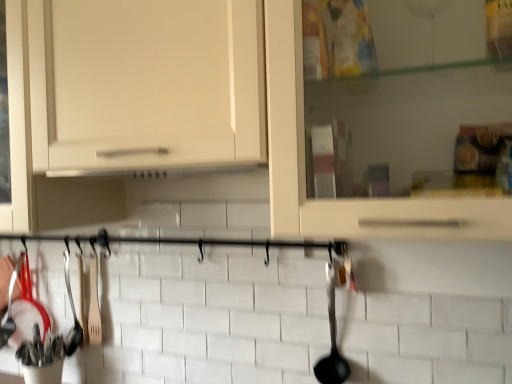
In order to face black plastic ladle at right, acting as the 2th silverware starting from the left, should I rotate leftwards or rightwards?

Turn right by 10.298 degrees to look at black plastic ladle at right, acting as the 2th silverware starting from the left.

Where is `wooden spatula at left, which is the 1th silverware in left-to-right order`? wooden spatula at left, which is the 1th silverware in left-to-right order is located at coordinates tap(72, 313).

Are white matte cabinet at center and black plastic ladle at right, the 1th silverware when ordered from right to left, beside each other?

white matte cabinet at center and black plastic ladle at right, the 1th silverware when ordered from right to left, are not in contact.

Which object is further away from the camera, white matte cabinet at center or black plastic ladle at right, which is the second silverware from back to front?

black plastic ladle at right, which is the second silverware from back to front, is further from the camera.

Does white matte cabinet at center have a smaller size compared to black plastic ladle at right, the 1th silverware when ordered from right to left?

No, white matte cabinet at center is not smaller than black plastic ladle at right, the 1th silverware when ordered from right to left.

From the image's perspective, does white matte cabinet at center appear lower than black plastic ladle at right, acting as the 2th silverware starting from the left?

No, from the image's perspective, white matte cabinet at center is not below black plastic ladle at right, acting as the 2th silverware starting from the left.

Is wooden spatula at left, acting as the second silverware starting from the right, bigger or smaller than white matte cabinet at center?

wooden spatula at left, acting as the second silverware starting from the right, is smaller than white matte cabinet at center.

Does wooden spatula at left, the 1th silverware viewed from the back, turn towards white matte cabinet at center?

No, wooden spatula at left, the 1th silverware viewed from the back, is not oriented towards white matte cabinet at center.

Based on the photo, considering the relative sizes of wooden spatula at left, acting as the second silverware starting from the right, and white matte cabinet at center in the image provided, is wooden spatula at left, acting as the second silverware starting from the right, thinner than white matte cabinet at center?

Yes.

From a real-world perspective, between wooden spatula at left, acting as the second silverware starting from the right, and black plastic ladle at right, placed as the first silverware when sorted from front to back, who is vertically lower?

From a 3D spatial view, black plastic ladle at right, placed as the first silverware when sorted from front to back, is below.

How different are the orientations of wooden spatula at left, positioned as the 2th silverware in front-to-back order, and black plastic ladle at right, which is the second silverware from back to front, in degrees?

There is a 0.00177-degree angle between the facing directions of wooden spatula at left, positioned as the 2th silverware in front-to-back order, and black plastic ladle at right, which is the second silverware from back to front.

Based on the photo, is black plastic ladle at right, acting as the 2th silverware starting from the left, located within wooden spatula at left, positioned as the 2th silverware in front-to-back order?

No, black plastic ladle at right, acting as the 2th silverware starting from the left, is not a part of wooden spatula at left, positioned as the 2th silverware in front-to-back order.

From a real-world perspective, is black plastic ladle at right, acting as the 2th silverware starting from the left, below white matte cabinet at center?

Correct, in the physical world, black plastic ladle at right, acting as the 2th silverware starting from the left, is lower than white matte cabinet at center.

Which object is further away from the camera taking this photo, black plastic ladle at right, acting as the 2th silverware starting from the left, or white matte cabinet at center?

black plastic ladle at right, acting as the 2th silverware starting from the left, is further away from the camera.

Looking at their sizes, would you say black plastic ladle at right, which is the second silverware from back to front, is wider or thinner than white matte cabinet at center?

black plastic ladle at right, which is the second silverware from back to front, is thinner than white matte cabinet at center.

From the image's perspective, is black plastic ladle at right, acting as the 2th silverware starting from the left, positioned above or below wooden spatula at left, acting as the second silverware starting from the right?

black plastic ladle at right, acting as the 2th silverware starting from the left, is above wooden spatula at left, acting as the second silverware starting from the right.

Which is more to the left, black plastic ladle at right, the 1th silverware when ordered from right to left, or wooden spatula at left, acting as the second silverware starting from the right?

wooden spatula at left, acting as the second silverware starting from the right, is more to the left.

Which object is closer to the camera taking this photo, black plastic ladle at right, the 1th silverware when ordered from right to left, or wooden spatula at left, which is the 1th silverware in left-to-right order?

Positioned in front is black plastic ladle at right, the 1th silverware when ordered from right to left.

Can you tell me how much black plastic ladle at right, which is the second silverware from back to front, and wooden spatula at left, which is the 1th silverware in left-to-right order, differ in facing direction?

The facing directions of black plastic ladle at right, which is the second silverware from back to front, and wooden spatula at left, which is the 1th silverware in left-to-right order, are 0.00177 degrees apart.

From a real-world perspective, does white matte cabinet at center sit lower than wooden spatula at left, acting as the second silverware starting from the right?

No, from a real-world perspective, white matte cabinet at center is not under wooden spatula at left, acting as the second silverware starting from the right.

Is white matte cabinet at center not inside wooden spatula at left, positioned as the 2th silverware in front-to-back order?

That's correct, white matte cabinet at center is outside of wooden spatula at left, positioned as the 2th silverware in front-to-back order.

Identify the location of silverware on the left of white matte cabinet at center. (72, 313).

Which is farther from the camera, (22, 222) or (68, 269)?

The point (68, 269) is more distant.

Where is `cabinetry above the black plastic ladle at right, placed as the first silverware when sorted from front to back (from a real-world perspective)`? The image size is (512, 384). cabinetry above the black plastic ladle at right, placed as the first silverware when sorted from front to back (from a real-world perspective) is located at coordinates (354, 198).

At what (x,y) coordinates should I click in order to perform the action: click on cabinetry in front of the wooden spatula at left, positioned as the 2th silverware in front-to-back order. Please return your answer as a coordinate pair (x, y). The height and width of the screenshot is (384, 512). Looking at the image, I should click on (354, 198).

From the image, which object appears to be farther from wooden spatula at left, acting as the second silverware starting from the right, black plastic ladle at right, the 1th silverware when ordered from right to left, or white matte cabinet at center?

Based on the image, white matte cabinet at center appears to be further to wooden spatula at left, acting as the second silverware starting from the right.

Considering their positions, is wooden spatula at left, acting as the second silverware starting from the right, positioned closer to black plastic ladle at right, placed as the first silverware when sorted from front to back, than white matte cabinet at center?

white matte cabinet at center lies closer to black plastic ladle at right, placed as the first silverware when sorted from front to back, than the other object.

Looking at the image, which one is located further to white matte cabinet at center, wooden spatula at left, the 1th silverware viewed from the back, or black plastic ladle at right, which is the second silverware from back to front?

The object further to white matte cabinet at center is wooden spatula at left, the 1th silverware viewed from the back.

From the image, which object appears to be nearer to white matte cabinet at center, black plastic ladle at right, acting as the 2th silverware starting from the left, or wooden spatula at left, positioned as the 2th silverware in front-to-back order?

black plastic ladle at right, acting as the 2th silverware starting from the left, is positioned closer to the anchor white matte cabinet at center.

Based on their spatial positions, is white matte cabinet at center or black plastic ladle at right, acting as the 2th silverware starting from the left, further from wooden spatula at left, which is the 1th silverware in left-to-right order?

white matte cabinet at center is positioned further to the anchor wooden spatula at left, which is the 1th silverware in left-to-right order.

Considering their positions, is white matte cabinet at center positioned closer to black plastic ladle at right, which is the second silverware from back to front, than wooden spatula at left, positioned as the 2th silverware in front-to-back order?

Based on the image, white matte cabinet at center appears to be nearer to black plastic ladle at right, which is the second silverware from back to front.

Find the location of `cabinetry between wooden spatula at left, which is the 1th silverware in left-to-right order, and black plastic ladle at right, acting as the 2th silverware starting from the left, in the horizontal direction`. cabinetry between wooden spatula at left, which is the 1th silverware in left-to-right order, and black plastic ladle at right, acting as the 2th silverware starting from the left, in the horizontal direction is located at coordinates (354, 198).